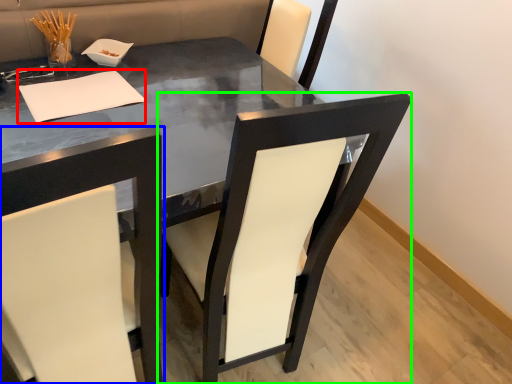
Question: Considering the real-world distances, which object is farthest from notepad (highlighted by a red box)? chair (highlighted by a blue box) or chair (highlighted by a green box)?

Choices:
 (A) chair
 (B) chair

Answer: (A)